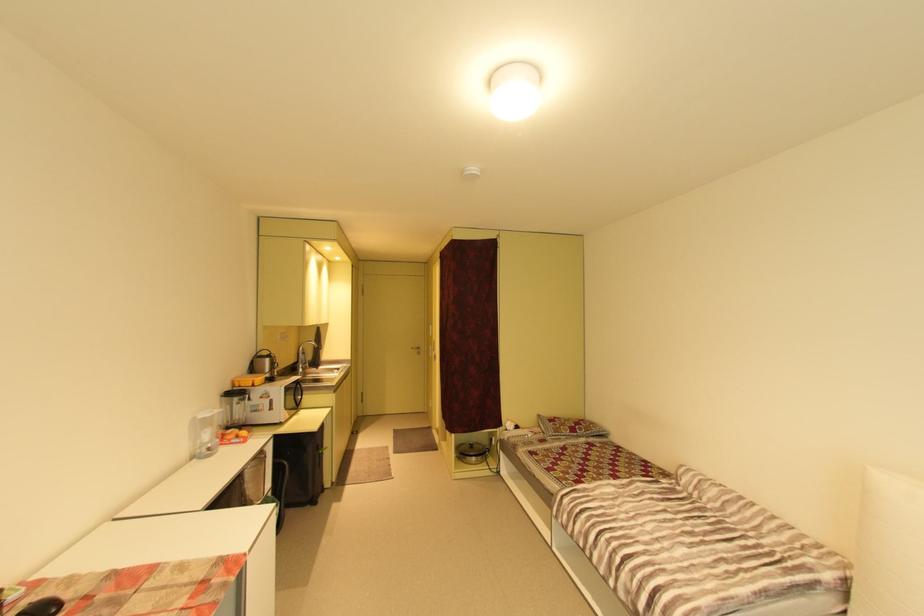
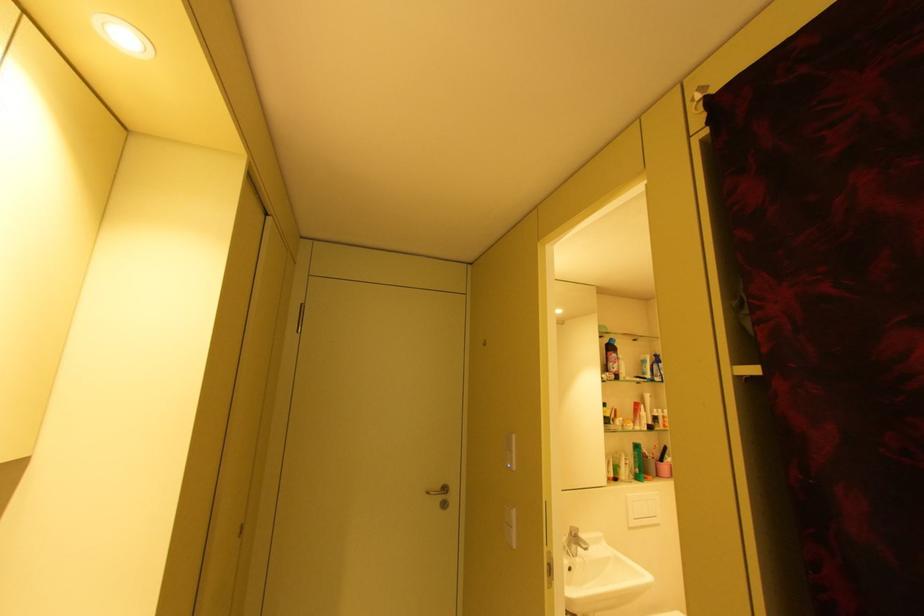
Locate, in the second image, the point that corresponds to point 419,349 in the first image.

(434, 493)